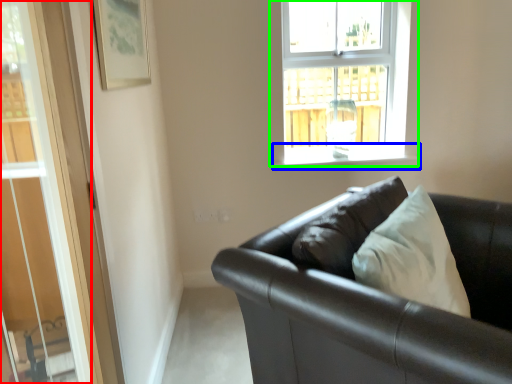
Question: Estimate the real-world distances between objects in this image. Which object is closer to glass door (highlighted by a red box), window sill (highlighted by a blue box) or window (highlighted by a green box)?

Choices:
 (A) window sill
 (B) window

Answer: (A)